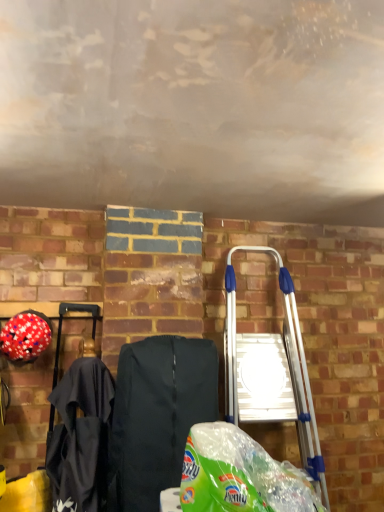
Question: Could you tell me if red matte helmet at left is turned towards silver metallic ladder at right?

Choices:
 (A) yes
 (B) no

Answer: (B)

Question: Considering the relative positions of red matte helmet at left and silver metallic ladder at right in the image provided, is red matte helmet at left in front of silver metallic ladder at right?

Choices:
 (A) yes
 (B) no

Answer: (B)

Question: From a real-world perspective, is red matte helmet at left under silver metallic ladder at right?

Choices:
 (A) no
 (B) yes

Answer: (A)

Question: Is red matte helmet at left further to camera compared to silver metallic ladder at right?

Choices:
 (A) no
 (B) yes

Answer: (B)

Question: Is red matte helmet at left at the left side of silver metallic ladder at right?

Choices:
 (A) no
 (B) yes

Answer: (B)

Question: Does red matte helmet at left have a lesser height compared to silver metallic ladder at right?

Choices:
 (A) no
 (B) yes

Answer: (B)

Question: From the image's perspective, is red matte helmet at left located beneath green plastic grocery bag at lower center?

Choices:
 (A) yes
 (B) no

Answer: (B)

Question: Is red matte helmet at left smaller than green plastic grocery bag at lower center?

Choices:
 (A) yes
 (B) no

Answer: (A)

Question: Can you confirm if red matte helmet at left is thinner than green plastic grocery bag at lower center?

Choices:
 (A) yes
 (B) no

Answer: (A)

Question: Is red matte helmet at left oriented away from green plastic grocery bag at lower center?

Choices:
 (A) yes
 (B) no

Answer: (B)

Question: Could you tell me if red matte helmet at left is turned towards green plastic grocery bag at lower center?

Choices:
 (A) no
 (B) yes

Answer: (A)

Question: From a real-world perspective, is red matte helmet at left below green plastic grocery bag at lower center?

Choices:
 (A) no
 (B) yes

Answer: (A)

Question: Considering the relative sizes of silver metallic ladder at right and black fabric folding chair at center in the image provided, is silver metallic ladder at right smaller than black fabric folding chair at center?

Choices:
 (A) no
 (B) yes

Answer: (A)